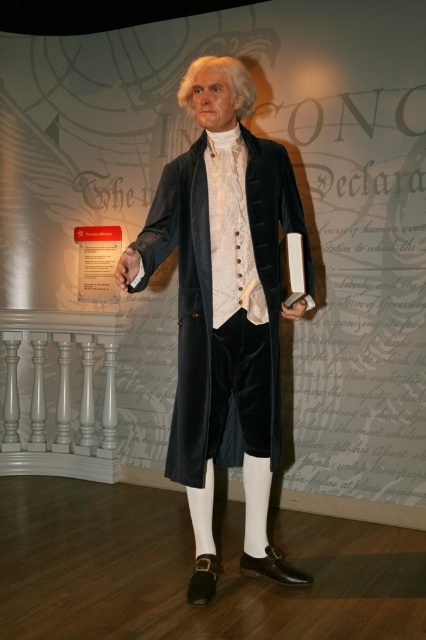
Is the position of velvet black coat at center more distant than that of white/smooth wig at upper center?

No.

Is velvet black coat at center to the left of white/smooth wig at upper center from the viewer's perspective?

Yes, velvet black coat at center is to the left of white/smooth wig at upper center.

You are a GUI agent. You are given a task and a screenshot of the screen. Output one action in this format:
    pyautogui.click(x=<x>, y=<y>)
    Task: Click on the velvet black coat at center
    The height and width of the screenshot is (640, 426).
    Given the screenshot: What is the action you would take?
    pyautogui.click(x=226, y=320)

You are a GUI agent. You are given a task and a screenshot of the screen. Output one action in this format:
    pyautogui.click(x=<x>, y=<y>)
    Task: Click on the velvet black coat at center
    The height and width of the screenshot is (640, 426).
    Given the screenshot: What is the action you would take?
    pyautogui.click(x=226, y=320)

Does velvet black coat at center have a greater height compared to white matte hand at center?

Correct, velvet black coat at center is much taller as white matte hand at center.

Where is `velvet black coat at center`? velvet black coat at center is located at coordinates (226, 320).

Between velvet black coat at center and white matte paper at center, which one has more height?

Standing taller between the two is velvet black coat at center.

Does point (270, 355) come closer to viewer compared to point (296, 307)?

No, (270, 355) is behind (296, 307).

Between point (275, 429) and point (293, 301), which one is positioned in front?

Point (293, 301) is in front.

Locate an element on the screen. This screenshot has width=426, height=640. velvet black coat at center is located at coordinates (226, 320).